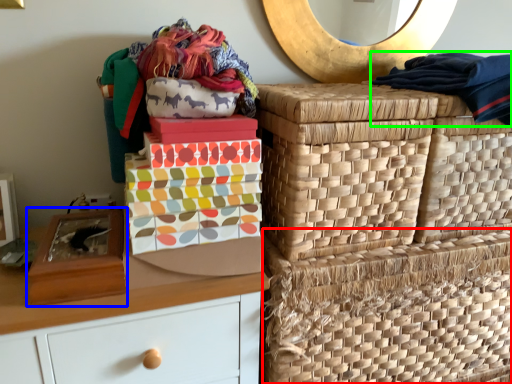
Question: Based on their relative distances, which object is nearer to basket (highlighted by a red box)? Choose from shoe box (highlighted by a blue box) and clothing (highlighted by a green box).

Choices:
 (A) shoe box
 (B) clothing

Answer: (B)